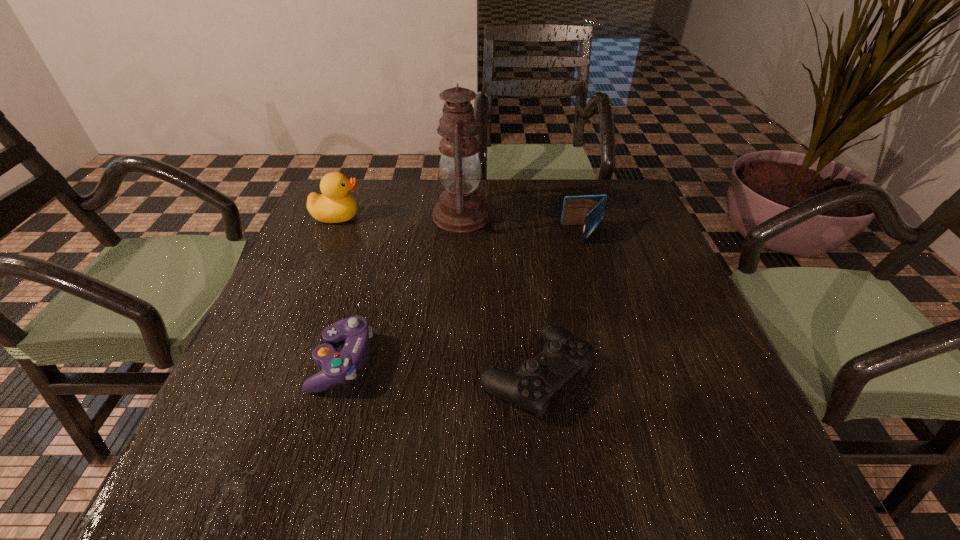
Locate an element on the screen. This screenshot has height=540, width=960. free region located on the exterior surface of the third tallest object is located at coordinates (439, 234).

Where is `vacant space situated on the exterior surface of the third tallest object`? vacant space situated on the exterior surface of the third tallest object is located at coordinates (446, 234).

Identify the location of vacant space situated on the left of the right control. (281, 374).

Find the location of a particular element. This screenshot has height=540, width=960. free space located 0.090m on the right of the left control is located at coordinates (419, 361).

Locate an element on the screen. Image resolution: width=960 pixels, height=540 pixels. oil lamp positioned at the far edge is located at coordinates (461, 208).

This screenshot has height=540, width=960. I want to click on duck positioned at the far edge, so click(334, 205).

You are a GUI agent. You are given a task and a screenshot of the screen. Output one action in this format:
    pyautogui.click(x=<x>, y=<y>)
    Task: Click on the wallet at the far edge
    The height and width of the screenshot is (540, 960).
    Given the screenshot: What is the action you would take?
    pyautogui.click(x=587, y=210)

What are the coordinates of `duck present at the left edge` in the screenshot? It's located at (334, 205).

Where is `control that is at the left edge`? Image resolution: width=960 pixels, height=540 pixels. control that is at the left edge is located at coordinates (337, 367).

Find the location of a particular element. object located at the right edge is located at coordinates (587, 210).